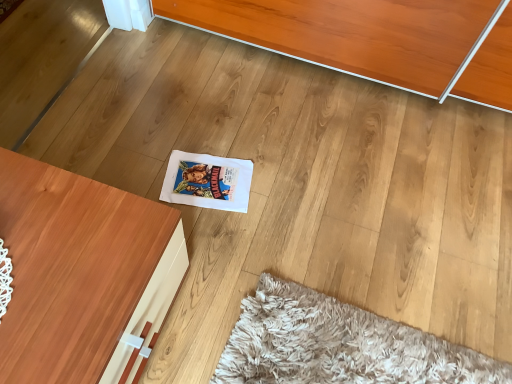
This screenshot has height=384, width=512. Identify the location of vacant region above white paper comic book at center (from a real-world perspective). (206, 183).